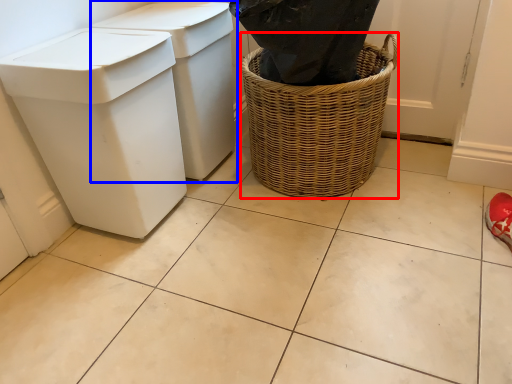
Question: Among these objects, which one is farthest to the camera, basket container (highlighted by a red box) or waste container (highlighted by a blue box)?

Choices:
 (A) basket container
 (B) waste container

Answer: (B)